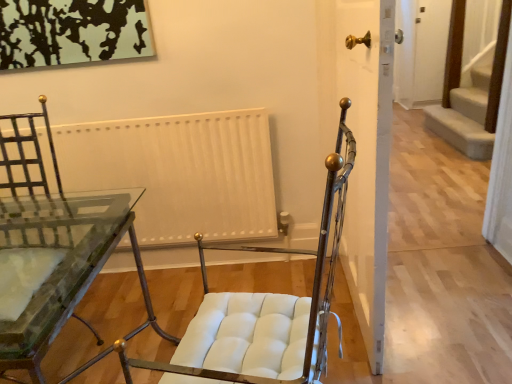
You are a GUI agent. You are given a task and a screenshot of the screen. Output one action in this format:
    pyautogui.click(x=<x>, y=<y>)
    Task: Click on the vacant area on top of white matte radiator at center (from a real-world perspective)
    This screenshot has width=512, height=384.
    Given the screenshot: What is the action you would take?
    pyautogui.click(x=130, y=121)